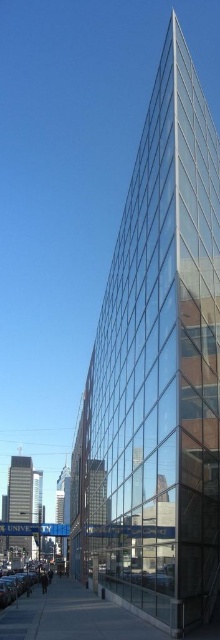
In the scene shown: Between concrete sidewalk at lower center and shiny silver car at lower left, which one has more height?

shiny silver car at lower left is taller.

Does concrete sidewalk at lower center appear on the left side of shiny silver car at lower left?

No, concrete sidewalk at lower center is not to the left of shiny silver car at lower left.

Which is behind, point (216, 636) or point (18, 586)?

Positioned behind is point (18, 586).

In order to click on concrete sidewalk at lower center in this screenshot , I will do `click(71, 616)`.